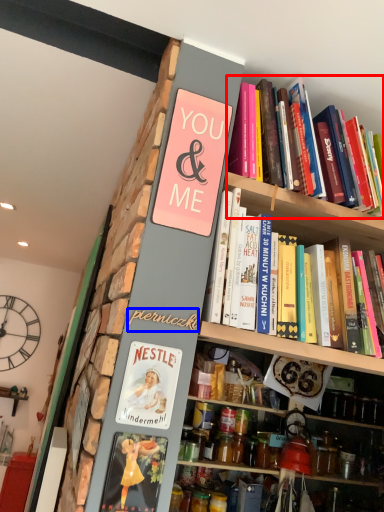
Question: Which point is closer to the camera, book (highlighted by a red box) or writing (highlighted by a blue box)?

Choices:
 (A) book
 (B) writing

Answer: (B)